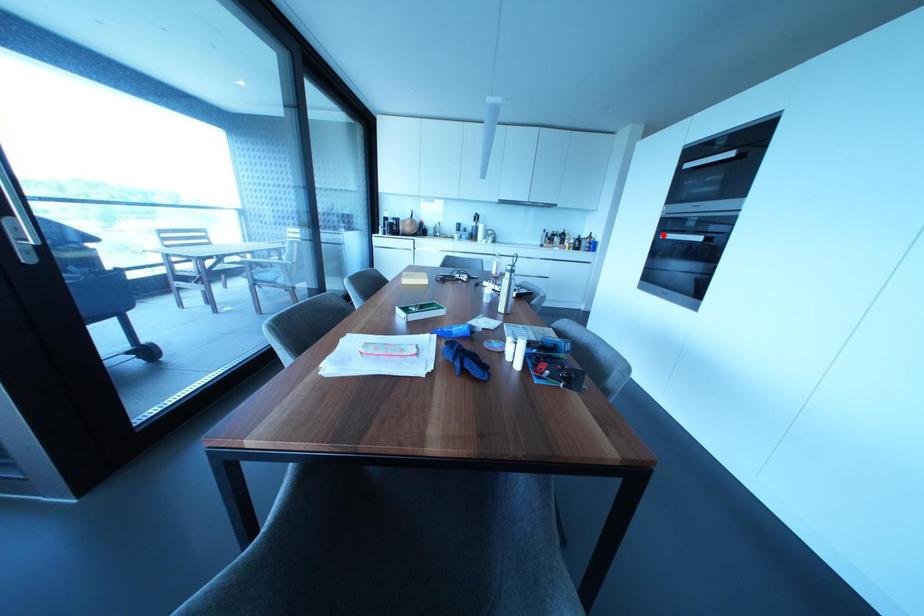
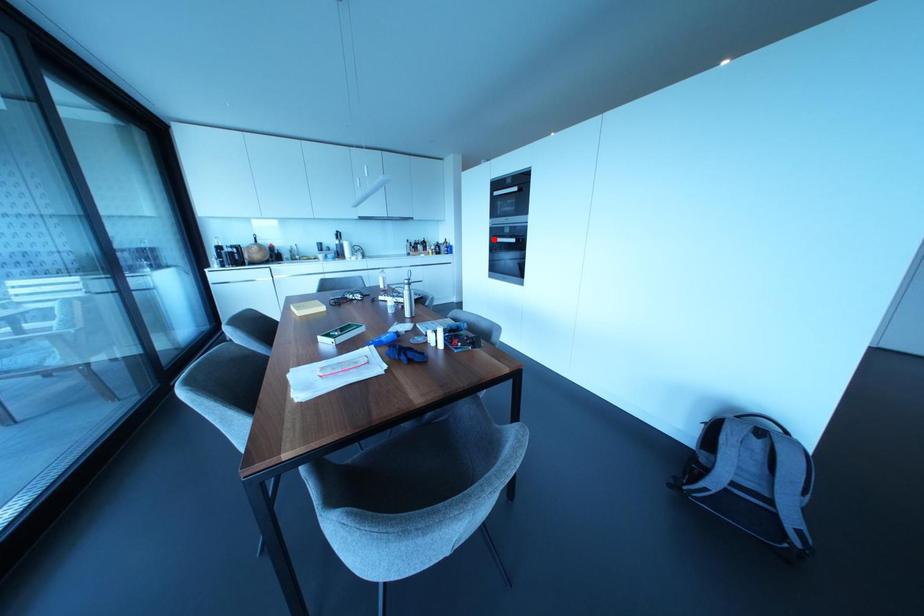
I am providing you with two images of the same scene from different viewpoints. A red point is marked on the first image and another point is marked on the second image. Is the marked point in image1 the same physical position as the marked point in image2?

Yes